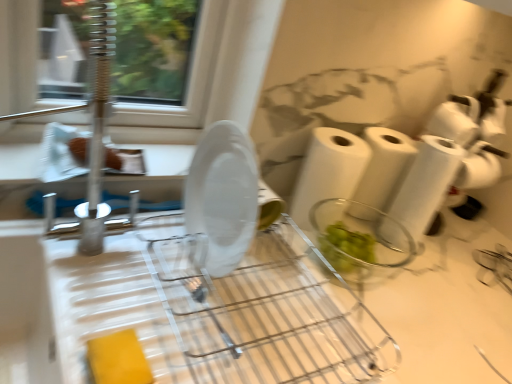
Question: Is point [478, 140] positioned closer to the camera than point [486, 96]?

Choices:
 (A) closer
 (B) farther

Answer: (A)

Question: Would you say white matte toilet paper at right, which is counted as the second toilet paper, starting from the bottom, is to the left or to the right of white paper towel at right, which ranks as the 2th toilet paper in top-to-bottom order, in the picture?

Choices:
 (A) right
 (B) left

Answer: (A)

Question: Which is nearer to the white paper towel at center, placed as the first paper towel when sorted from left to right?

Choices:
 (A) white matte toilet paper at center, the first toilet paper positioned from the bottom
 (B) white matte toilet paper at upper right, the fourth toilet paper ordered from the bottom
 (C) white paper towel at right, which ranks as the 2th toilet paper in top-to-bottom order
 (D) white paper towel at center, the 2th paper towel in the left-to-right sequence
 (E) white matte toilet paper at right, which is counted as the second toilet paper, starting from the bottom

Answer: (D)

Question: Which is nearer to the white matte toilet paper at center, marked as the 4th toilet paper in a top-to-bottom arrangement?

Choices:
 (A) white matte toilet paper at right, which is counted as the 3th toilet paper, starting from the top
 (B) white matte toilet paper at upper right, the fourth toilet paper ordered from the bottom
 (C) transparent plastic plate at center
 (D) white paper towel at center, which is counted as the 1th paper towel, starting from the right
 (E) white paper towel at right, arranged as the third toilet paper when ordered from the bottom

Answer: (D)